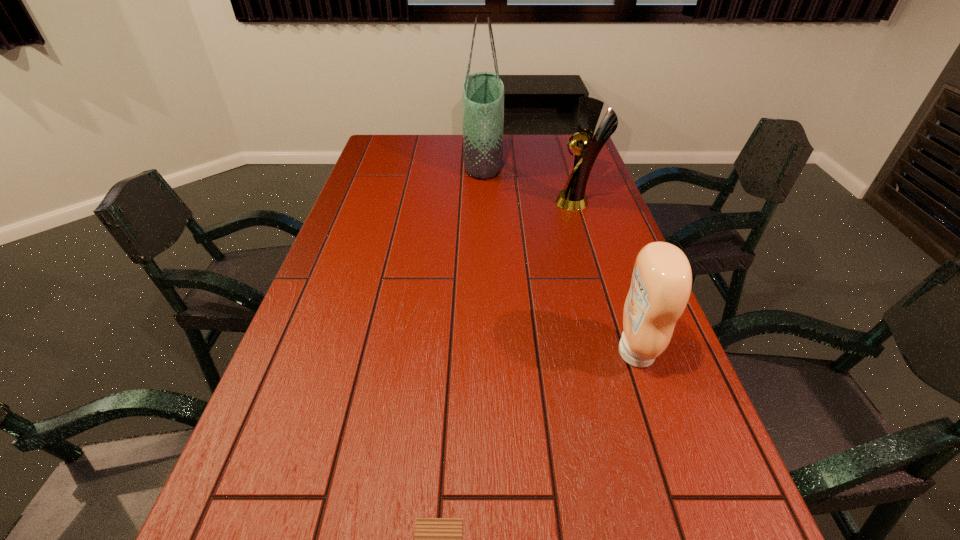
Identify the location of the tallest object. (483, 93).

The image size is (960, 540). Identify the location of tote bag. (483, 93).

The width and height of the screenshot is (960, 540). I want to click on the second farthest object, so click(x=572, y=197).

The width and height of the screenshot is (960, 540). What are the coordinates of `condiment` in the screenshot? It's located at (661, 283).

At what (x,y) coordinates should I click in order to perform the action: click on vacant space located 0.100m on the left of the farthest object. Please return your answer as a coordinate pair (x, y). The height and width of the screenshot is (540, 960). Looking at the image, I should click on (438, 159).

The height and width of the screenshot is (540, 960). I want to click on vacant position located at the front of the third nearest object, where the globe is visible, so click(456, 201).

Locate an element on the screen. This screenshot has width=960, height=540. free spot located 0.230m at the front of the third nearest object, where the globe is visible is located at coordinates (486, 201).

Identify the location of vacant space located 0.140m at the front of the third nearest object, where the globe is visible. This screenshot has height=540, width=960. (513, 201).

Locate an element on the screen. The height and width of the screenshot is (540, 960). vacant region located on the label of the third farthest object is located at coordinates pyautogui.click(x=446, y=353).

Identify the location of vacant space located 0.080m on the label of the third farthest object. This screenshot has width=960, height=540. (580, 353).